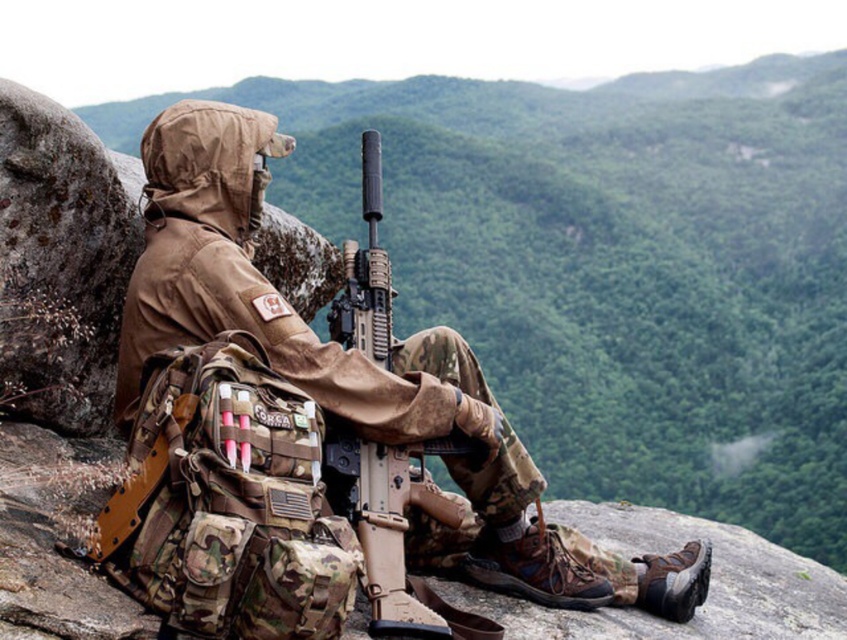
You are a military supply inspector checking the equipment of a soldier. The soldier is wearing a camo fabric uniform at center and has a matte black rifle at center. According to regulations, the rifle must be at least 12 inches away from the uniform to prevent fabric damage from the rifle barrel. Is the current distance compliant with the regulation?

The camo fabric uniform at center is 10.98 inches from the matte black rifle at center. Since 10.98 inches is less than the required 12 inches, the current distance does not comply with the regulation to prevent fabric damage from the rifle barrel.

You are a drone operator viewing this image. The system requires you to mark the center point of the camo fabric uniform at center. What are the coordinates you should input?

The coordinates to input are (319, 340) as the 2D location of the camo fabric uniform at center is at point (319, 340).